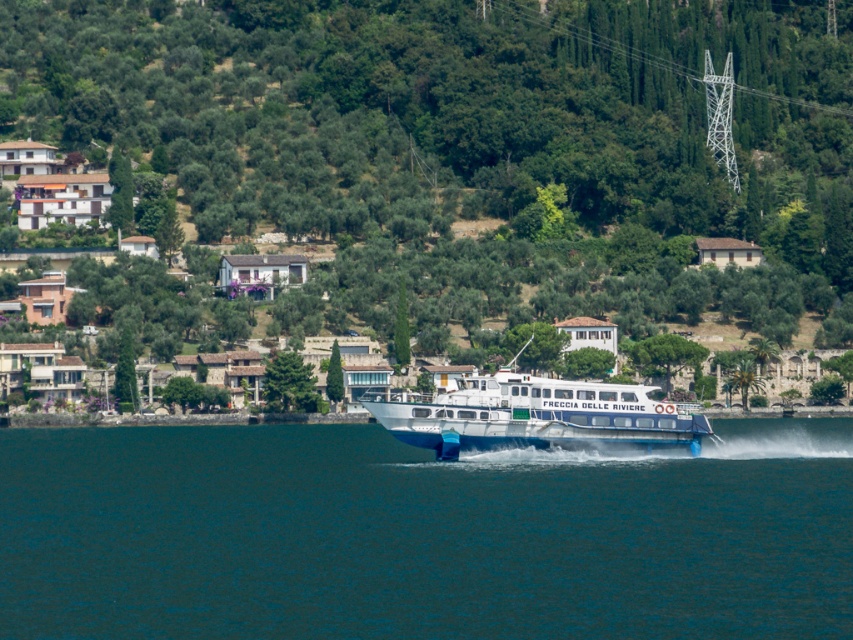
Question: Which point is farther to the camera?

Choices:
 (A) white glossy hydrofoil boat at center
 (B) white metallic tower at upper center

Answer: (B)

Question: Which point appears closest to the camera in this image?

Choices:
 (A) (596, 401)
 (B) (538, 612)

Answer: (B)

Question: Is white glossy hydrofoil boat at center wider than white metallic tower at upper center?

Choices:
 (A) yes
 (B) no

Answer: (B)

Question: Which point is closer to the camera?

Choices:
 (A) (457, 400)
 (B) (328, 625)
 (C) (646, 58)

Answer: (B)

Question: Is white glossy hydrofoil boat at center positioned before white metallic tower at upper center?

Choices:
 (A) no
 (B) yes

Answer: (B)

Question: Observing the image, what is the correct spatial positioning of white glossy hydrofoil boat at center in reference to white metallic tower at upper center?

Choices:
 (A) left
 (B) right

Answer: (A)